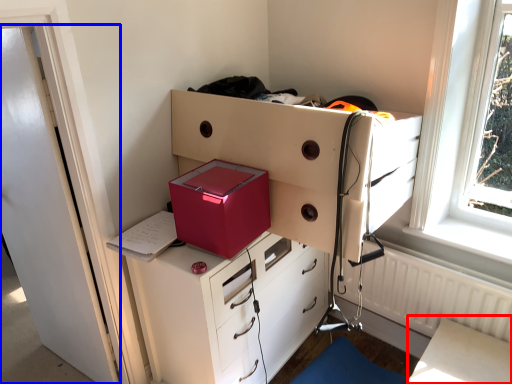
Question: Which of the following is the closest to the observer, table (highlighted by a red box) or door (highlighted by a blue box)?

Choices:
 (A) table
 (B) door

Answer: (B)